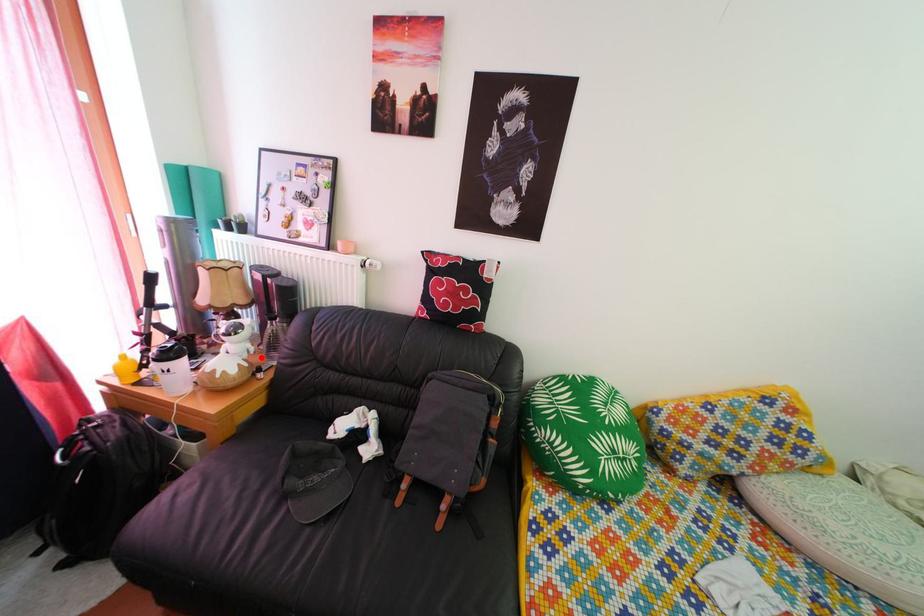
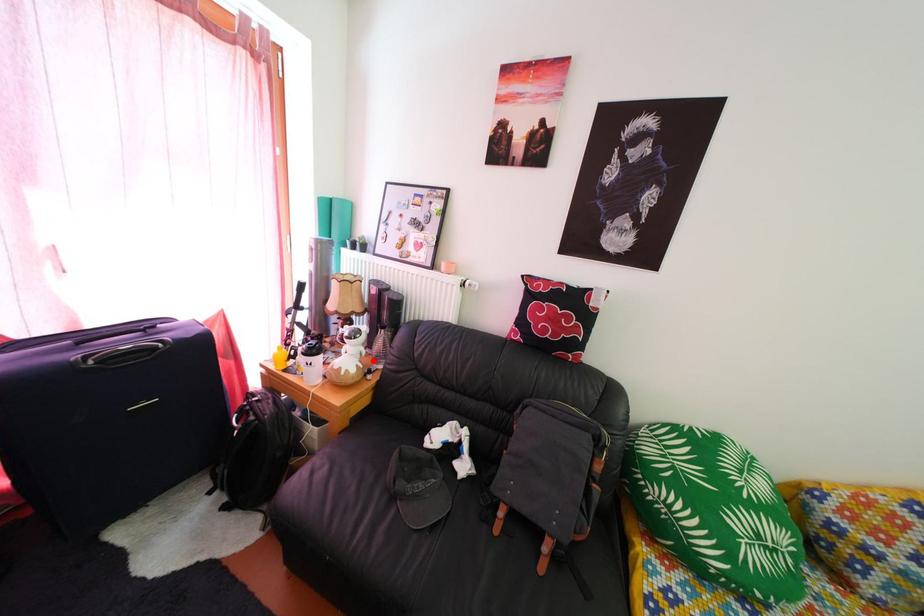
I am providing you with two images of the same scene from different viewpoints. A red point is marked on the first image and another point is marked on the second image. Does the point marked in image1 correspond to the same location as the one in image2?

Yes